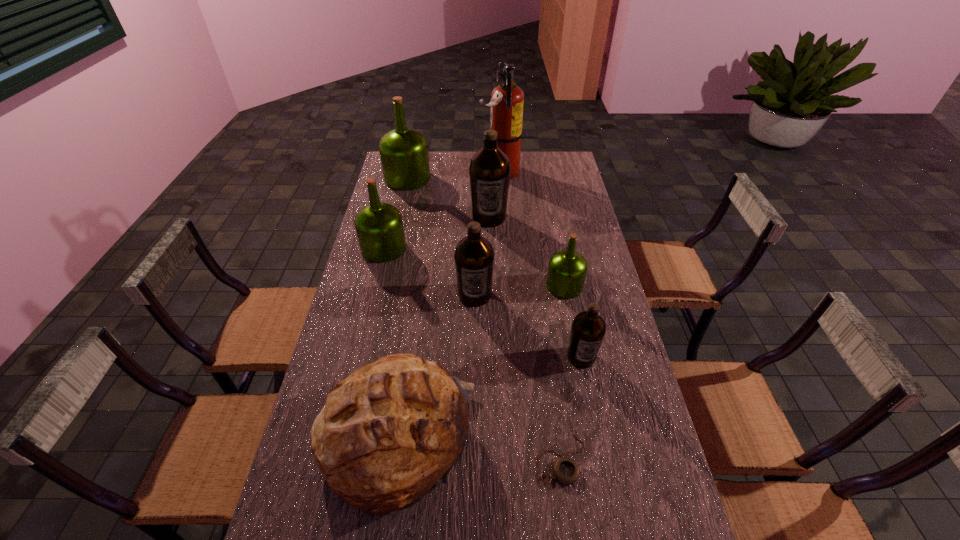
Where is `vacant space at the left edge`? This screenshot has width=960, height=540. vacant space at the left edge is located at coordinates (388, 280).

In the image, there is a desktop. Where is `vacant space at the right edge`? vacant space at the right edge is located at coordinates (662, 530).

This screenshot has width=960, height=540. In order to click on free point at the far right corner in this screenshot , I will do `click(553, 152)`.

Where is `free space between the smallest green olive oil and the third farthest object`? This screenshot has width=960, height=540. free space between the smallest green olive oil and the third farthest object is located at coordinates coord(527,252).

Where is `vacant region between the third farthest object and the bread`? Image resolution: width=960 pixels, height=540 pixels. vacant region between the third farthest object and the bread is located at coordinates (444, 328).

In order to click on free spot between the second smallest brown olive oil and the smallest green olive oil in this screenshot , I will do `click(519, 291)`.

Image resolution: width=960 pixels, height=540 pixels. I want to click on free space that is in between the bread and the rightmost green olive oil, so click(481, 363).

You are a GUI agent. You are given a task and a screenshot of the screen. Output one action in this format:
    pyautogui.click(x=<x>, y=<y>)
    Task: Click on the blank region between the second biggest brown olive oil and the rightmost green olive oil
    This screenshot has width=960, height=540.
    Given the screenshot: What is the action you would take?
    pyautogui.click(x=519, y=291)

This screenshot has height=540, width=960. Find the location of `empty space between the nearest brown olive oil and the biggest brown olive oil`. empty space between the nearest brown olive oil and the biggest brown olive oil is located at coordinates [x=535, y=287].

At what (x,y) coordinates should I click in order to perform the action: click on free space between the smallest green olive oil and the second biggest brown olive oil. Please return your answer as a coordinate pair (x, y). Looking at the image, I should click on (519, 291).